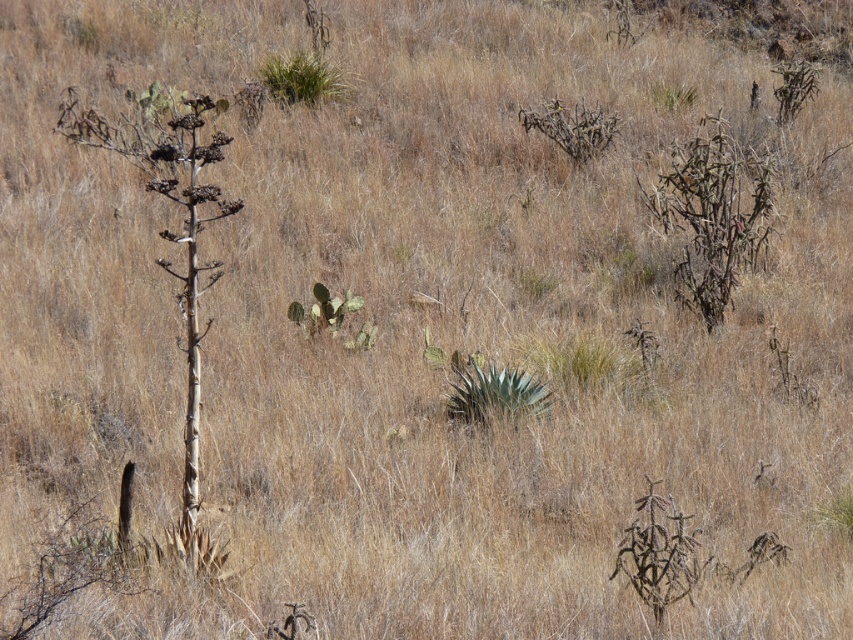
You are standing at the origin point of the coordinate system. You want to move towards the green leafy plant at center. Which direction should you move in?

You should move in the direction of the coordinate point [495,392] to reach the green leafy plant at center.

You are standing in the dry, arid landscape with tall grasses and cacti. You notice two points marked in the scene. Which point, point (x=479, y=387) or point (x=282, y=92), is closer to you?

Point (x=479, y=387) is closer to the camera than point (x=282, y=92).

What is located at the coordinates point [495,392] in the image?

The coordinates point [495,392] corresponds to the green leafy plant at center.